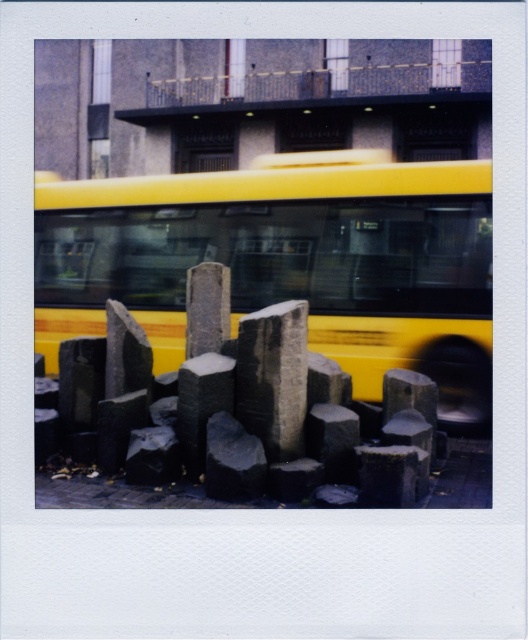
You are a pedestrian standing at the intersection and see the yellow matte bus at center and the dark gray stone at center. Which object is positioned higher in the image?

The yellow matte bus at center is located above the dark gray stone at center in the image.

You are a city planner analyzing the urban scene. The yellow bus is moving along the road. Where is the dark gray stone at center located in the image?

The dark gray stone at center is located at the 2D coordinates point (244,419) in the image.